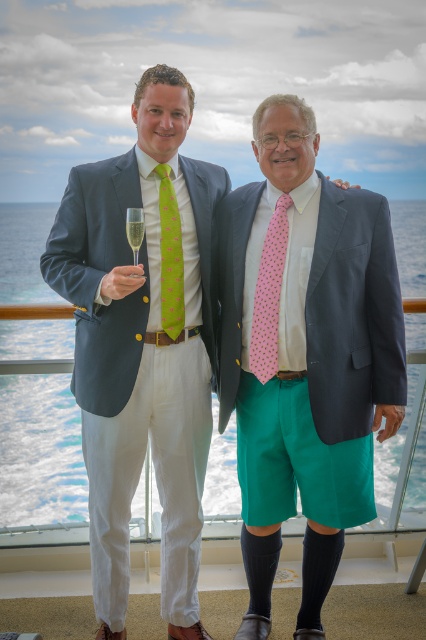
Question: Which point appears closest to the camera in this image?

Choices:
 (A) (157, 168)
 (B) (127, 236)
 (C) (268, 276)

Answer: (B)

Question: Can you confirm if pink printed tie at center is positioned to the left of clear glass at center?

Choices:
 (A) no
 (B) yes

Answer: (A)

Question: Is pink printed tie at center to the right of green printed tie at center from the viewer's perspective?

Choices:
 (A) no
 (B) yes

Answer: (B)

Question: Which of the following is the closest to the observer?

Choices:
 (A) pink printed tie at center
 (B) clear glass at center
 (C) pink dotted tie at center

Answer: (B)

Question: Which point appears closest to the camera in this image?

Choices:
 (A) (262, 337)
 (B) (256, 288)
 (C) (164, 285)
 (D) (138, 252)

Answer: (D)

Question: Can you confirm if pink printed tie at center is positioned above green printed tie at center?

Choices:
 (A) no
 (B) yes

Answer: (A)